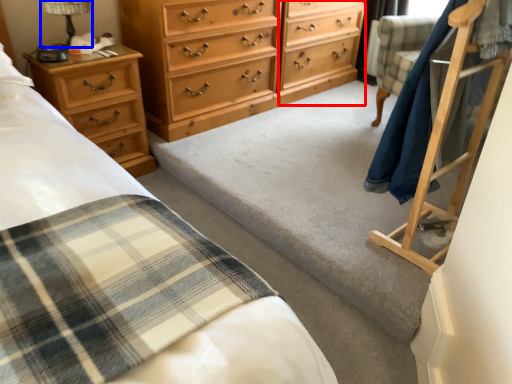
Question: Which of the following is the closest to the observer, file cabinet (highlighted by a red box) or table lamp (highlighted by a blue box)?

Choices:
 (A) file cabinet
 (B) table lamp

Answer: (B)